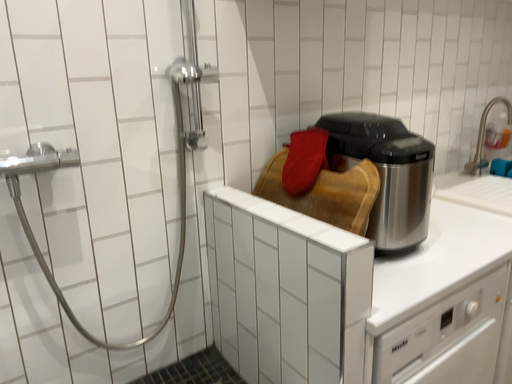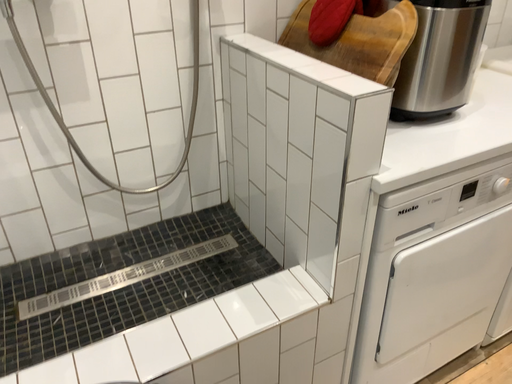
Question: Which way did the camera rotate in the video?

Choices:
 (A) rotated downward
 (B) rotated upward

Answer: (A)